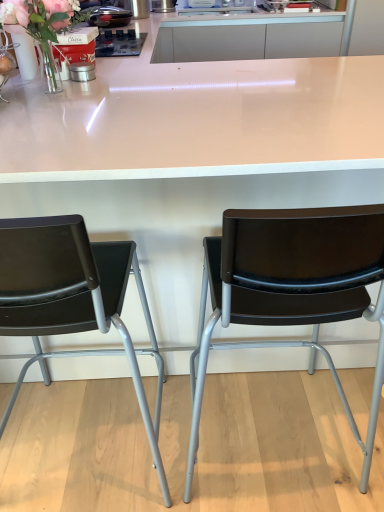
Question: Is matte black chair at left, the 2th chair viewed from the right, closer to the viewer compared to clear glass vase at left?

Choices:
 (A) no
 (B) yes

Answer: (B)

Question: Is matte black chair at left, the 1th chair from the left, next to clear glass vase at left?

Choices:
 (A) yes
 (B) no

Answer: (B)

Question: From the image's perspective, is matte black chair at left, the 1th chair from the left, below clear glass vase at left?

Choices:
 (A) no
 (B) yes

Answer: (B)

Question: Is matte black chair at left, the 2th chair viewed from the right, shorter than clear glass vase at left?

Choices:
 (A) no
 (B) yes

Answer: (A)

Question: From the image's perspective, is matte black chair at left, the 2th chair viewed from the right, over clear glass vase at left?

Choices:
 (A) yes
 (B) no

Answer: (B)

Question: Considering the positions of point (165, 10) and point (48, 65), is point (165, 10) closer or farther from the camera than point (48, 65)?

Choices:
 (A) farther
 (B) closer

Answer: (A)

Question: Do you think metallic silver canister at center, which is counted as the 1th appliance, starting from the back, is within clear glass vase at left, or outside of it?

Choices:
 (A) inside
 (B) outside

Answer: (B)

Question: Based on their positions, is metallic silver canister at center, acting as the 1th appliance starting from the top, located to the left or right of clear glass vase at left?

Choices:
 (A) right
 (B) left

Answer: (A)

Question: In terms of size, does metallic silver canister at center, which appears as the third appliance when viewed from the left, appear bigger or smaller than clear glass vase at left?

Choices:
 (A) small
 (B) big

Answer: (B)

Question: From a real-world perspective, is translucent glass vase at upper left physically located above or below clear glass vase at left?

Choices:
 (A) below
 (B) above

Answer: (B)

Question: Is translucent glass vase at upper left inside or outside of clear glass vase at left?

Choices:
 (A) inside
 (B) outside

Answer: (B)

Question: Visually, is translucent glass vase at upper left positioned to the left or to the right of clear glass vase at left?

Choices:
 (A) right
 (B) left

Answer: (A)

Question: Is point (0, 13) positioned closer to the camera than point (61, 91)?

Choices:
 (A) farther
 (B) closer

Answer: (B)

Question: Considering the positions of white glossy table at center and black plastic chair at center, the 1th chair in the right-to-left sequence, in the image, is white glossy table at center taller or shorter than black plastic chair at center, the 1th chair in the right-to-left sequence,?

Choices:
 (A) tall
 (B) short

Answer: (A)

Question: In terms of size, does white glossy table at center appear bigger or smaller than black plastic chair at center, the 1th chair in the right-to-left sequence?

Choices:
 (A) small
 (B) big

Answer: (B)